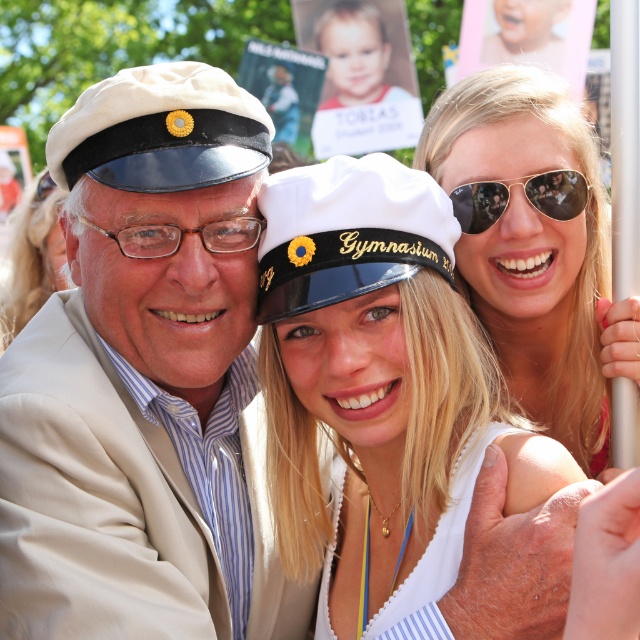
Question: Can you confirm if white glossy cap at center is wider than blonde hair at center?

Choices:
 (A) yes
 (B) no

Answer: (A)

Question: Does sunglasses at upper right have a greater width compared to gold reflective aviator sunglasses at upper center?

Choices:
 (A) no
 (B) yes

Answer: (B)

Question: Is white glossy cap at center positioned in front of sunglasses at upper right?

Choices:
 (A) yes
 (B) no

Answer: (A)

Question: Among these points, which one is farthest from the camera?

Choices:
 (A) (218, 248)
 (B) (480, 195)
 (C) (32, 216)

Answer: (C)

Question: Which point appears farthest from the camera in this image?

Choices:
 (A) (35, 250)
 (B) (616, 369)
 (C) (554, 170)

Answer: (A)

Question: Among these objects, which one is nearest to the camera?

Choices:
 (A) white glossy cap at center
 (B) matte white cap at center
 (C) tortoiseshell plastic glasses at center

Answer: (A)